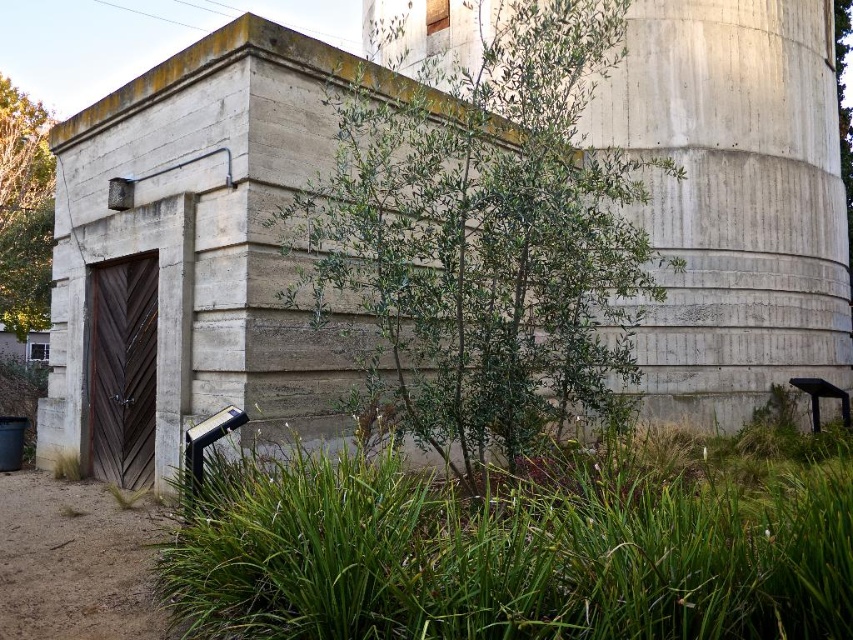
You are a gardener assessing the plants in the scene. Which of the two plants, the green leafy shrub at center or the green leafy tree at left, requires more frequent watering due to its size?

The green leafy tree at left requires more frequent watering because it is larger than the green leafy shrub at center.

You are standing in front of the concrete structure and want to know which plant is taller between the green leafy shrub at center and the green leafy tree at left. Can you tell me?

The green leafy tree at left is taller than the green leafy shrub at center.